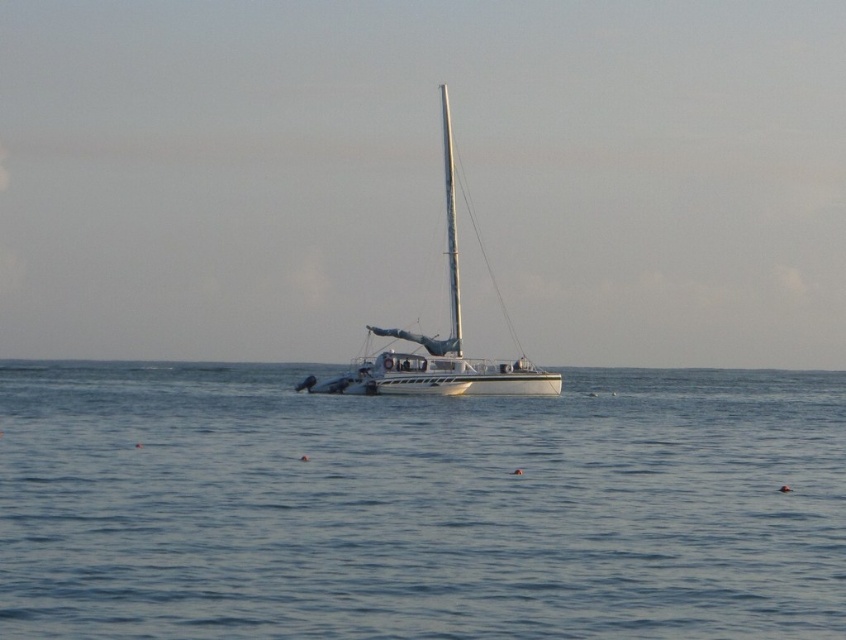
Question: Which object appears farthest from the camera in this image?

Choices:
 (A) white glossy sailboat at center
 (B) white matte mast at center
 (C) blue water at center

Answer: (B)

Question: Based on their relative distances, which object is nearer to the blue water at center?

Choices:
 (A) white glossy sailboat at center
 (B) white matte mast at center

Answer: (A)

Question: Does white glossy sailboat at center have a smaller size compared to white matte mast at center?

Choices:
 (A) yes
 (B) no

Answer: (B)

Question: Which of the following is the farthest from the observer?

Choices:
 (A) (25, 380)
 (B) (383, 364)
 (C) (448, 276)

Answer: (A)

Question: Can you confirm if blue water at center is positioned above white glossy sailboat at center?

Choices:
 (A) yes
 (B) no

Answer: (B)

Question: Is blue water at center closer to the viewer compared to white glossy sailboat at center?

Choices:
 (A) yes
 (B) no

Answer: (A)